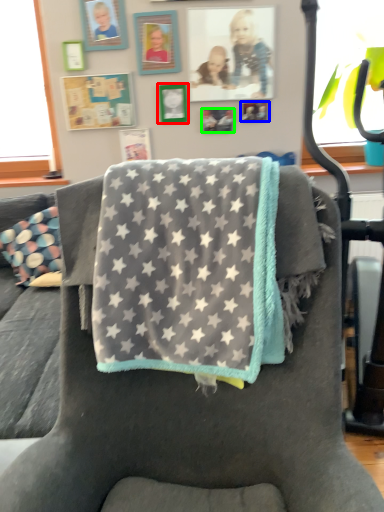
Question: Which object is the farthest from picture frame (highlighted by a red box)? Choose among these: picture frame (highlighted by a blue box) or picture frame (highlighted by a green box).

Choices:
 (A) picture frame
 (B) picture frame

Answer: (A)